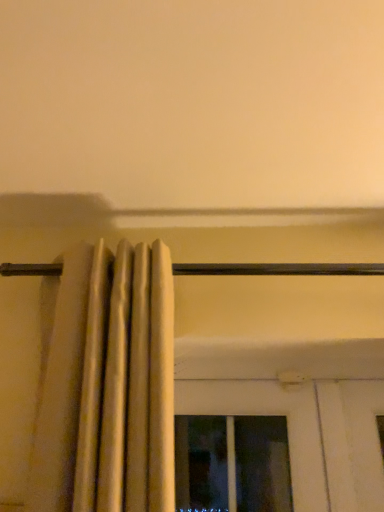
What do you see at coordinates (278, 269) in the screenshot? Image resolution: width=384 pixels, height=512 pixels. I see `black metal rail at upper center` at bounding box center [278, 269].

Locate an element on the screen. black metal rail at upper center is located at coordinates (278, 269).

At what (x,y) coordinates should I click in order to perform the action: click on black metal rail at upper center. Please return your answer as a coordinate pair (x, y). This screenshot has width=384, height=512. Looking at the image, I should click on (278, 269).